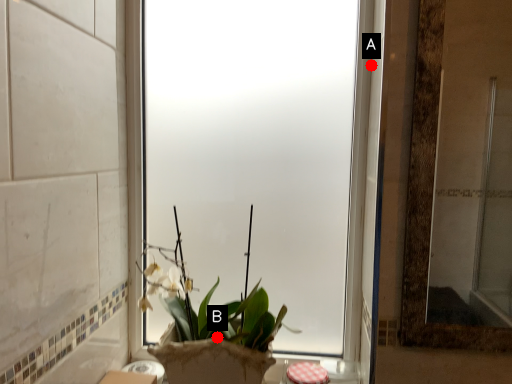
Question: Two points are circled on the image, labeled by A and B beside each circle. Among these points, which one is nearest to the camera?

Choices:
 (A) A is closer
 (B) B is closer

Answer: (A)